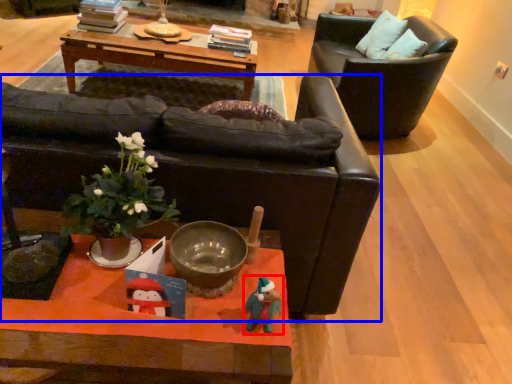
Question: Which point is further to the camera, toy (highlighted by a red box) or chair (highlighted by a blue box)?

Choices:
 (A) toy
 (B) chair

Answer: (B)